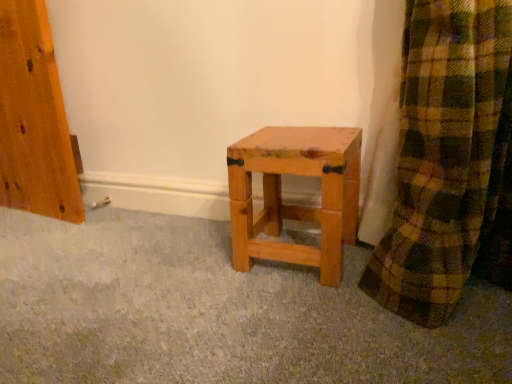
Question: Does natural wood stool at center have a lesser height compared to natural wood stool at center?

Choices:
 (A) no
 (B) yes

Answer: (B)

Question: Considering the relative positions of natural wood stool at center and natural wood stool at center in the image provided, is natural wood stool at center to the right of natural wood stool at center from the viewer's perspective?

Choices:
 (A) no
 (B) yes

Answer: (A)

Question: From a real-world perspective, does natural wood stool at center sit lower than natural wood stool at center?

Choices:
 (A) no
 (B) yes

Answer: (B)

Question: From the image's perspective, would you say natural wood stool at center is shown under natural wood stool at center?

Choices:
 (A) yes
 (B) no

Answer: (A)

Question: Can you confirm if natural wood stool at center is smaller than natural wood stool at center?

Choices:
 (A) yes
 (B) no

Answer: (B)

Question: Is natural wood stool at center not inside natural wood stool at center?

Choices:
 (A) yes
 (B) no

Answer: (A)

Question: From the image's perspective, does natural wood stool at center appear lower than natural wood stool at center?

Choices:
 (A) no
 (B) yes

Answer: (A)

Question: Can you confirm if natural wood stool at center is taller than natural wood stool at center?

Choices:
 (A) yes
 (B) no

Answer: (A)

Question: Is natural wood stool at center aimed at natural wood stool at center?

Choices:
 (A) no
 (B) yes

Answer: (A)

Question: Are natural wood stool at center and natural wood stool at center located far from each other?

Choices:
 (A) yes
 (B) no

Answer: (B)

Question: Is natural wood stool at center facing away from natural wood stool at center?

Choices:
 (A) no
 (B) yes

Answer: (A)

Question: Is natural wood stool at center at the left side of natural wood stool at center?

Choices:
 (A) no
 (B) yes

Answer: (A)

Question: Looking at their shapes, would you say natural wood stool at center is wider or thinner than natural wood stool at center?

Choices:
 (A) wide
 (B) thin

Answer: (B)